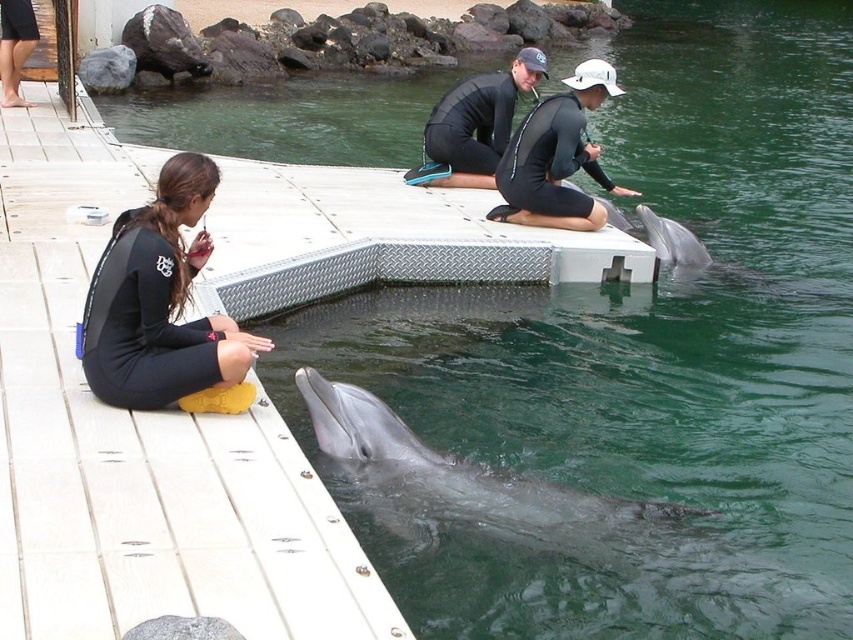
Question: Is gray smooth dolphin at lower center smaller than black matte wetsuit at center?

Choices:
 (A) no
 (B) yes

Answer: (A)

Question: Which of the following is the closest to the observer?

Choices:
 (A) matte black wetsuit at center
 (B) black matte wetsuit at center

Answer: (A)

Question: In this image, where is gray smooth dolphin at lower center located relative to black matte wetsuit at center?

Choices:
 (A) left
 (B) right

Answer: (A)

Question: Which object is the closest to the gray smooth dolphin at lower center?

Choices:
 (A) gray smooth dolphin at right
 (B) matte black wetsuit at center
 (C) black matte wetsuit at center

Answer: (B)

Question: Is black neoprene wetsuit at left positioned in front of gray smooth dolphin at lower center?

Choices:
 (A) no
 (B) yes

Answer: (B)

Question: Which object is the closest to the matte black wetsuit at center?

Choices:
 (A) black neoprene wetsuit at left
 (B) black matte wetsuit at center
 (C) gray smooth dolphin at right
 (D) gray smooth dolphin at lower center

Answer: (B)